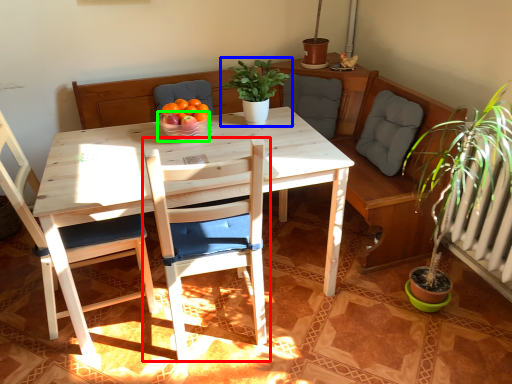
Question: Which is farther away from chair (highlighted by a red box)? houseplant (highlighted by a blue box) or glass bowl (highlighted by a green box)?

Choices:
 (A) houseplant
 (B) glass bowl

Answer: (A)